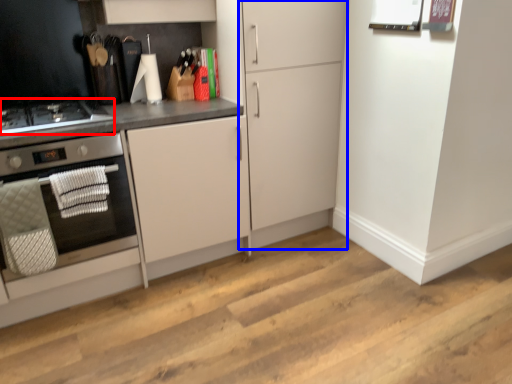
Question: Which object appears farthest to the camera in this image, gas stove (highlighted by a red box) or cabinetry (highlighted by a blue box)?

Choices:
 (A) gas stove
 (B) cabinetry

Answer: (B)